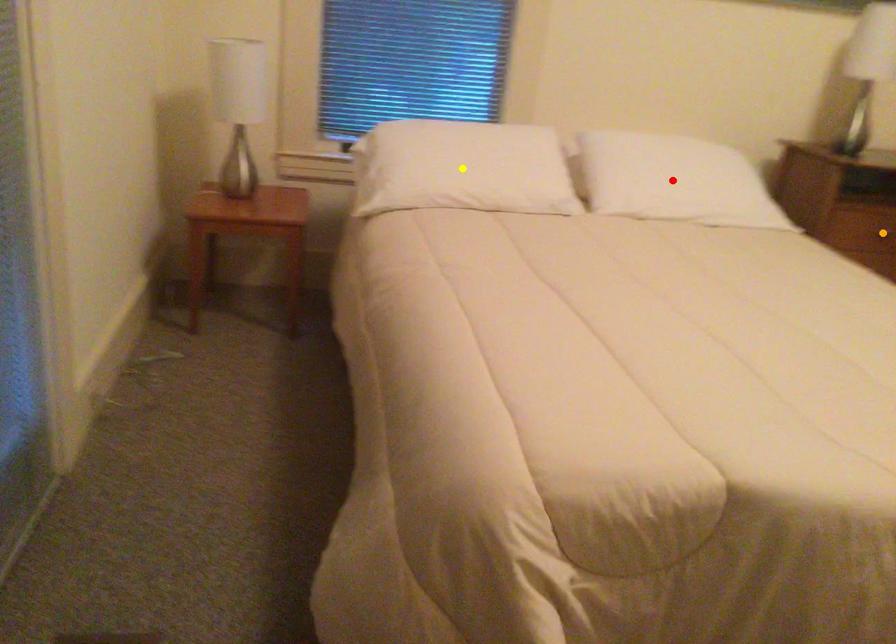
In the scene shown: Order these from farthest to nearest:
red point
orange point
yellow point

orange point < red point < yellow point